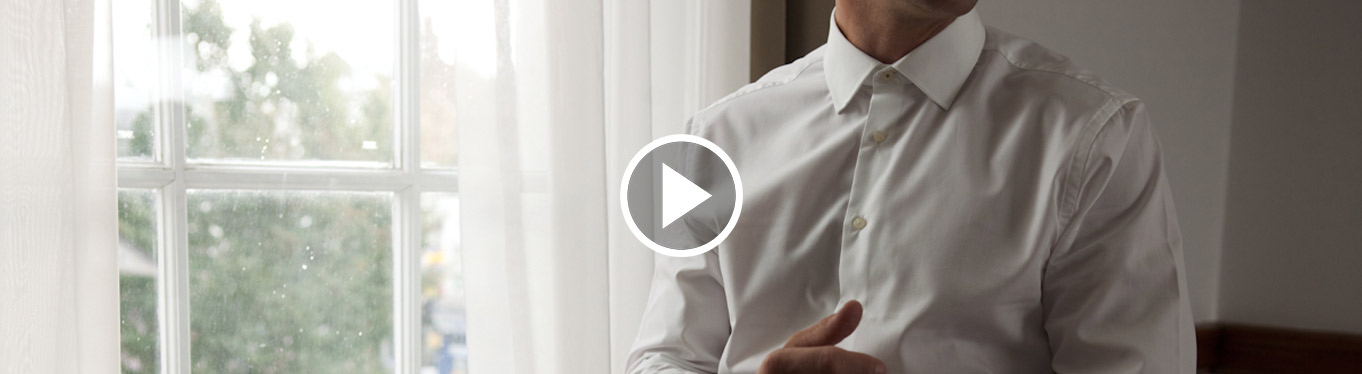
In order to click on beige wall behind person in this screenshot , I will do `click(771, 34)`.